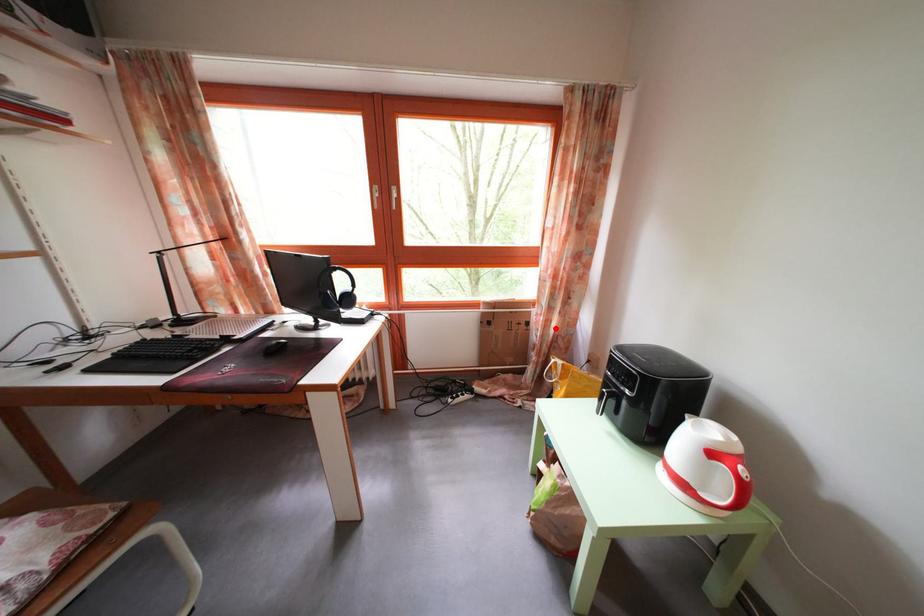
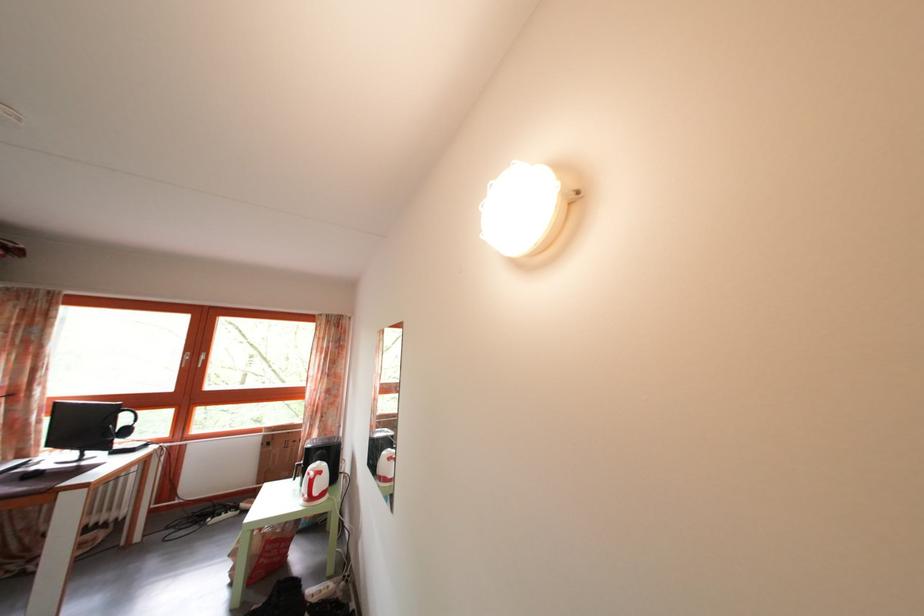
The point at the highlighted location is marked in the first image. Where is the corresponding point in the second image?

(317, 442)